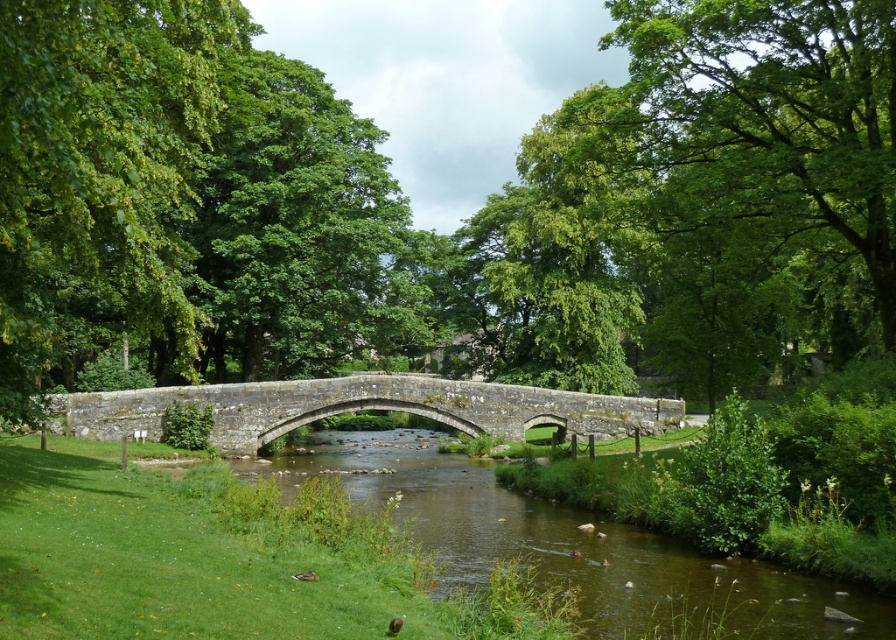
Question: Estimate the real-world distances between objects in this image. Which object is farther from the green leafy tree at center?

Choices:
 (A) green leafy tree at left
 (B) stone bridge at center

Answer: (B)

Question: Which object appears farthest from the camera in this image?

Choices:
 (A) green leafy tree at center
 (B) stone bridge at center

Answer: (B)

Question: Estimate the real-world distances between objects in this image. Which object is closer to the green leafy tree at center?

Choices:
 (A) stone bridge at center
 (B) green leafy tree at left

Answer: (B)

Question: Can you confirm if green leafy tree at center is positioned below stone bridge at center?

Choices:
 (A) no
 (B) yes

Answer: (A)

Question: Does green leafy tree at left have a greater width compared to stone bridge at center?

Choices:
 (A) no
 (B) yes

Answer: (A)

Question: Is green leafy tree at center smaller than green leafy tree at left?

Choices:
 (A) yes
 (B) no

Answer: (B)